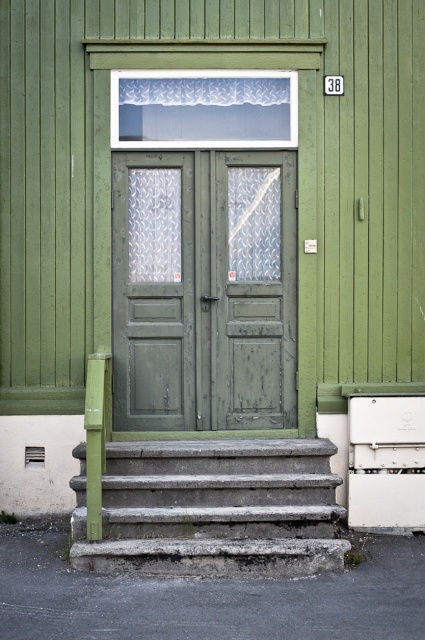
Between green wooden door at center and concrete steps at lower center, which one has more height?

green wooden door at center is taller.

Based on the photo, can you confirm if green wooden door at center is positioned above concrete steps at lower center?

Yes, green wooden door at center is above concrete steps at lower center.

Who is more distant from viewer, (x=268, y=352) or (x=130, y=490)?

Point (x=268, y=352)

Image resolution: width=425 pixels, height=640 pixels. Find the location of `green wooden door at center`. green wooden door at center is located at coordinates (204, 289).